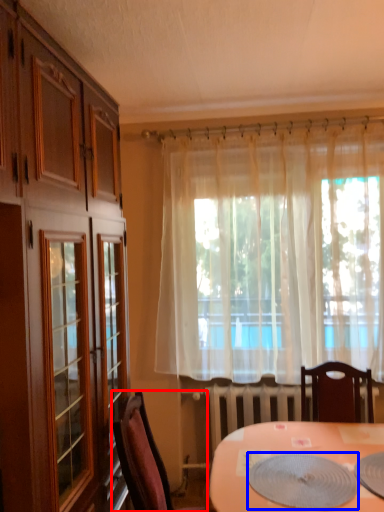
Question: Which point is further to the camera, chair (highlighted by a red box) or platter (highlighted by a blue box)?

Choices:
 (A) chair
 (B) platter

Answer: (A)